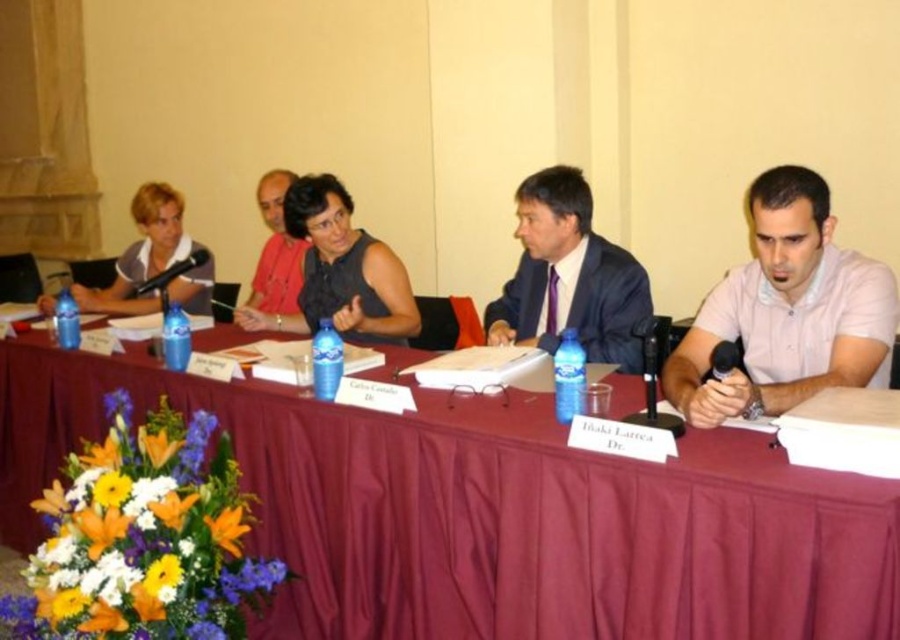
You are a photographer standing behind the long table at the formal meeting. You want to take a photo of both the light pink cotton shirt at right and the matte black shirt at left in the same frame. Given that your camera has a minimum focus distance of 8 feet, will you be able to capture both shirts in focus without moving closer?

The distance between the light pink cotton shirt at right and the matte black shirt at left is 8.97 feet, which exceeds the camera minimum focus distance of 8 feet. Therefore, the photographer can capture both shirts in focus without moving closer.

You are a photographer positioned behind the participants at the formal meeting. You need to capture a clear photo of the maroon fabric table at center and the black matte dress at center. Which object should you adjust your camera angle to focus on first to ensure it appears larger in the photo?

The maroon fabric table at center is taller than the black matte dress at center, so you should focus on the maroon fabric table at center first to ensure it appears larger in the photo.

You are attending a formal meeting and notice two items at the center of the table. Which item is positioned lower between the black matte dress at center and the matte black shirt at center?

The black matte dress at center is located below the matte black shirt at center, so the black matte dress at center is positioned lower.